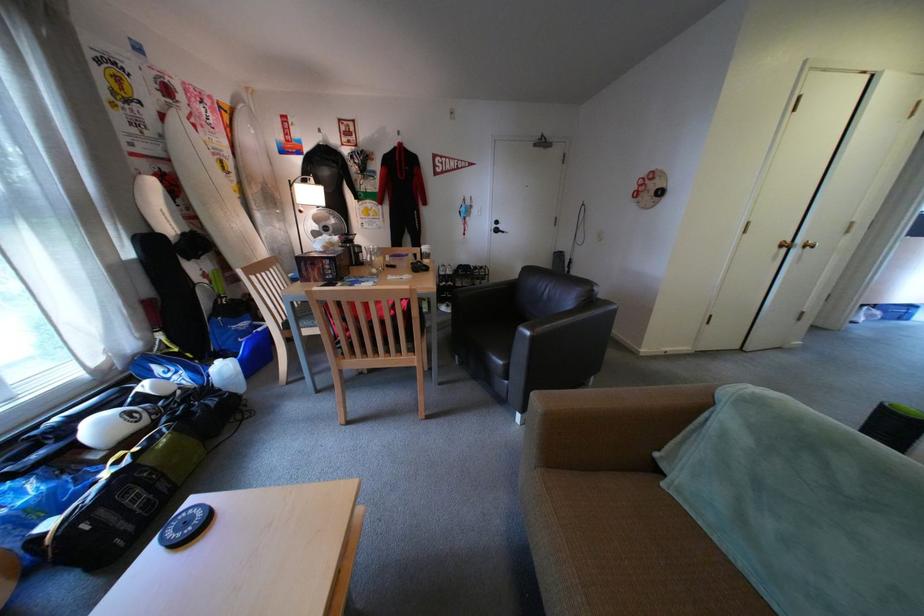
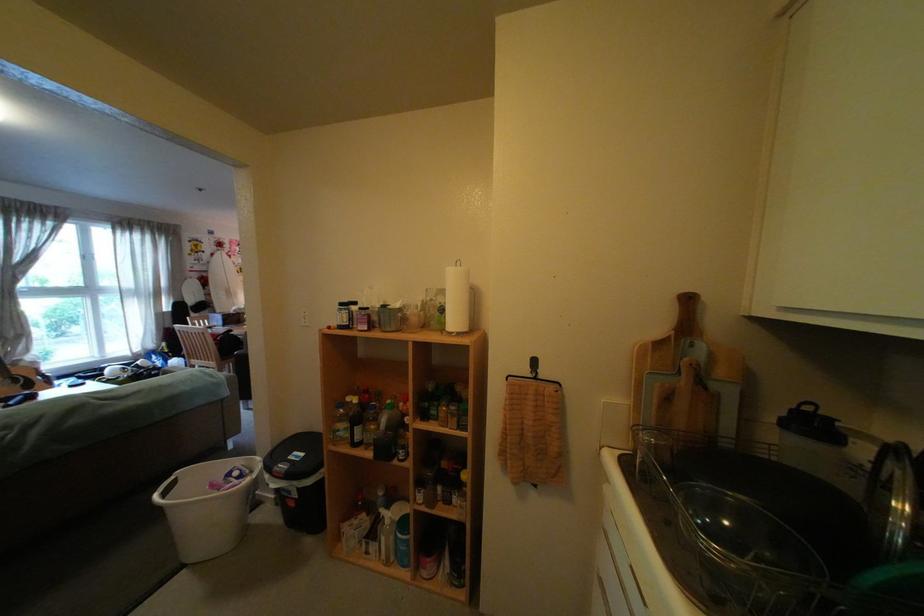
Question: The images are taken continuously from a first-person perspective. In which direction are you moving?

Choices:
 (A) Left
 (B) Right
 (C) Forward
 (D) Backward

Answer: (B)